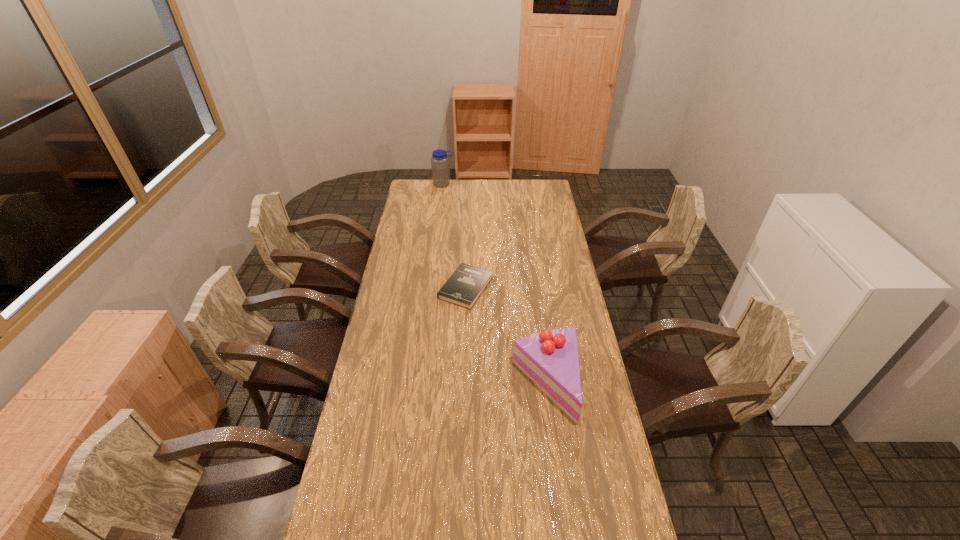
The width and height of the screenshot is (960, 540). I want to click on vacant area that lies between the shortest object and the water bottle, so click(x=455, y=236).

You are a GUI agent. You are given a task and a screenshot of the screen. Output one action in this format:
    pyautogui.click(x=<x>, y=<y>)
    Task: Click on the unoccupied area between the cake and the farthest object
    This screenshot has width=960, height=540.
    Given the screenshot: What is the action you would take?
    pyautogui.click(x=495, y=284)

At what (x,y) coordinates should I click in order to perform the action: click on unoccupied area between the farthest object and the nearest object. Please return your answer as a coordinate pair (x, y). This screenshot has width=960, height=540. Looking at the image, I should click on (495, 284).

Identify which object is the closest to the tallest object. Please provide its 2D coordinates. Your answer should be formatted as a tuple, i.e. [(x, y)], where the tuple contains the x and y coordinates of a point satisfying the conditions above.

[(464, 287)]

Identify which object is located as the second nearest to the second nearest object. Please provide its 2D coordinates. Your answer should be formatted as a tuple, i.e. [(x, y)], where the tuple contains the x and y coordinates of a point satisfying the conditions above.

[(440, 168)]

The height and width of the screenshot is (540, 960). Identify the location of vacant space that satisfies the following two spatial constraints: 1. with a carrying loop on the side of the book; 2. on the right side of the farthest object. (431, 288).

The width and height of the screenshot is (960, 540). What are the coordinates of `free space that satisfies the following two spatial constraints: 1. on the front side of the second nearest object; 2. on the left side of the rightmost object` in the screenshot? It's located at (463, 383).

The width and height of the screenshot is (960, 540). What are the coordinates of `vacant position in the image that satisfies the following two spatial constraints: 1. with a carrying loop on the side of the farthest object; 2. on the left side of the cake` in the screenshot? It's located at (419, 383).

Locate an element on the screen. The image size is (960, 540). free spot that satisfies the following two spatial constraints: 1. with a carrying loop on the side of the second shortest object; 2. on the right side of the farthest object is located at coordinates (419, 383).